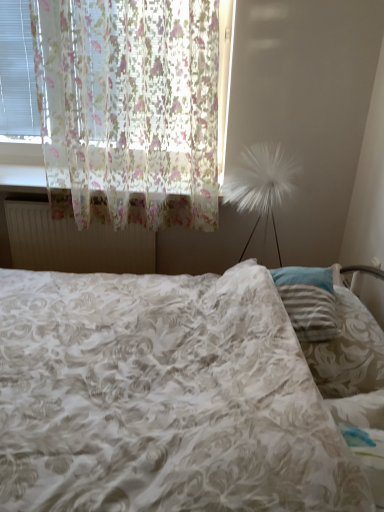
Question: From a real-world perspective, relative to white fluffy lamp at right, is floral fabric bed at center vertically above or below?

Choices:
 (A) above
 (B) below

Answer: (B)

Question: In the image, is floral fabric bed at center on the left side or the right side of white fluffy lamp at right?

Choices:
 (A) left
 (B) right

Answer: (A)

Question: Estimate the real-world distances between objects in this image. Which object is farther from the white matte radiator at upper left?

Choices:
 (A) floral fabric bed at center
 (B) white fluffy lamp at right
 (C) translucent floral fabric at left

Answer: (A)

Question: Considering the real-world distances, which object is farthest from the white matte radiator at upper left?

Choices:
 (A) white fluffy lamp at right
 (B) translucent floral fabric at left
 (C) floral fabric bed at center

Answer: (C)